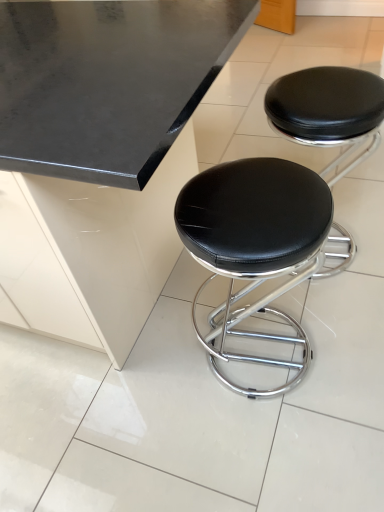
Question: Should I look upward or downward to see black leather stool at center, positioned as the 2th stool in right-to-left order?

Choices:
 (A) down
 (B) up

Answer: (A)

Question: Does black leather stool at center, which ranks as the 1th stool in right-to-left order, appear on the left side of black leather stool at center, the first stool in the left-to-right sequence?

Choices:
 (A) yes
 (B) no

Answer: (B)

Question: From the image's perspective, is black leather stool at center, positioned as the second stool in left-to-right order, on top of black leather stool at center, the first stool in the left-to-right sequence?

Choices:
 (A) no
 (B) yes

Answer: (B)

Question: Is black leather stool at center, positioned as the second stool in left-to-right order, outside black leather stool at center, positioned as the 2th stool in right-to-left order?

Choices:
 (A) no
 (B) yes

Answer: (B)

Question: Is black leather stool at center, positioned as the second stool in left-to-right order, surrounding black leather stool at center, positioned as the 2th stool in right-to-left order?

Choices:
 (A) yes
 (B) no

Answer: (B)

Question: Considering the relative sizes of black leather stool at center, positioned as the second stool in left-to-right order, and black leather stool at center, positioned as the 2th stool in right-to-left order, in the image provided, is black leather stool at center, positioned as the second stool in left-to-right order, thinner than black leather stool at center, positioned as the 2th stool in right-to-left order,?

Choices:
 (A) no
 (B) yes

Answer: (A)

Question: Is black leather stool at center, the first stool in the left-to-right sequence, shorter than black leather stool at center, positioned as the second stool in left-to-right order?

Choices:
 (A) yes
 (B) no

Answer: (A)

Question: From the image's perspective, is black leather stool at center, the first stool in the left-to-right sequence, on top of black leather stool at center, positioned as the second stool in left-to-right order?

Choices:
 (A) yes
 (B) no

Answer: (B)

Question: Is black leather stool at center, positioned as the 2th stool in right-to-left order, smaller than black leather stool at center, positioned as the second stool in left-to-right order?

Choices:
 (A) no
 (B) yes

Answer: (B)

Question: From the image's perspective, is black leather stool at center, the first stool in the left-to-right sequence, located beneath black leather stool at center, which ranks as the 1th stool in right-to-left order?

Choices:
 (A) no
 (B) yes

Answer: (B)

Question: Considering the relative positions of black leather stool at center, positioned as the 2th stool in right-to-left order, and black leather stool at center, positioned as the second stool in left-to-right order, in the image provided, is black leather stool at center, positioned as the 2th stool in right-to-left order, in front of black leather stool at center, positioned as the second stool in left-to-right order,?

Choices:
 (A) no
 (B) yes

Answer: (B)

Question: Is black leather stool at center, positioned as the second stool in left-to-right order, a part of black leather stool at center, positioned as the 2th stool in right-to-left order?

Choices:
 (A) yes
 (B) no

Answer: (B)

Question: From the image's perspective, is black leather stool at center, positioned as the second stool in left-to-right order, located above or below black leather stool at center, positioned as the 2th stool in right-to-left order?

Choices:
 (A) below
 (B) above

Answer: (B)